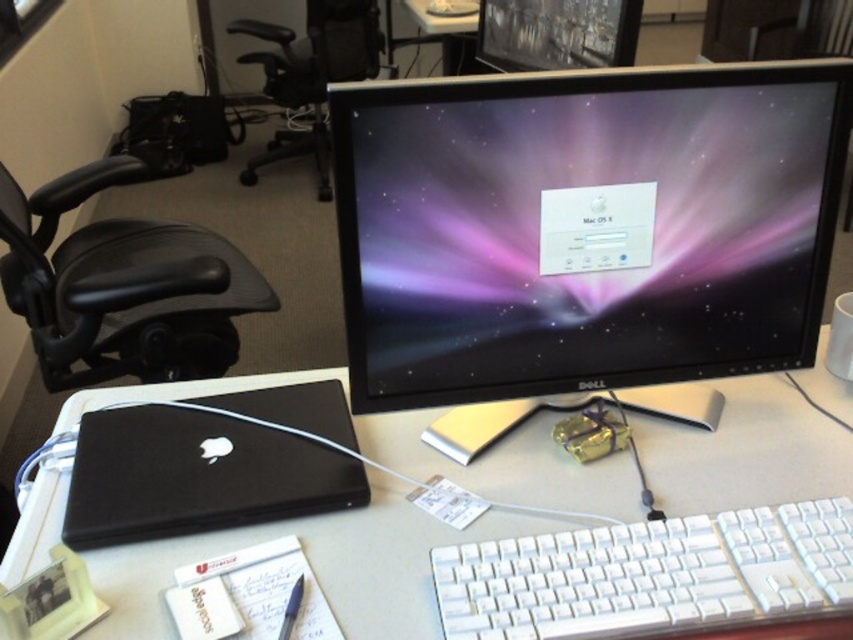
How much distance is there between black glossy monitor at center and black matte laptop at lower left?

The distance of black glossy monitor at center from black matte laptop at lower left is 30.62 centimeters.

This screenshot has width=853, height=640. In order to click on black glossy monitor at center in this screenshot , I will do [582, 188].

Does point (364, 243) come behind point (103, 474)?

No, (364, 243) is in front of (103, 474).

This screenshot has width=853, height=640. What are the coordinates of `black glossy monitor at center` in the screenshot? It's located at (582, 188).

Between black glossy monitor at center and black leather swivel chair at left, which one appears on the left side from the viewer's perspective?

black leather swivel chair at left is more to the left.

Is black glossy monitor at center wider than black leather swivel chair at left?

Incorrect, black glossy monitor at center's width does not surpass black leather swivel chair at left's.

Is point (538, 371) less distant than point (51, 371)?

Yes, point (538, 371) is closer to viewer.

Where is `black glossy monitor at center`? Image resolution: width=853 pixels, height=640 pixels. black glossy monitor at center is located at coordinates (582, 188).

Can you confirm if black glossy monitor at center is positioned to the left of matte black monitor at center?

Indeed, black glossy monitor at center is positioned on the left side of matte black monitor at center.

Looking at this image, between black glossy monitor at center and matte black monitor at center, which one is positioned lower?

black glossy monitor at center is lower down.

Is point (722, 182) closer to viewer compared to point (534, 38)?

Yes, point (722, 182) is closer to viewer.

Locate an element on the screen. This screenshot has height=640, width=853. black glossy monitor at center is located at coordinates (582, 188).